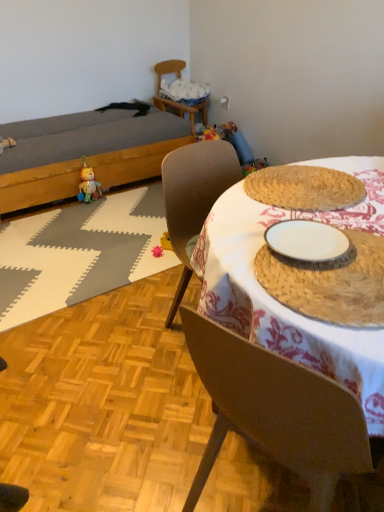
Where is `spots to the right of plush yellow bear at lower left, acting as the 1th toy starting from the left`? spots to the right of plush yellow bear at lower left, acting as the 1th toy starting from the left is located at coordinates (116, 203).